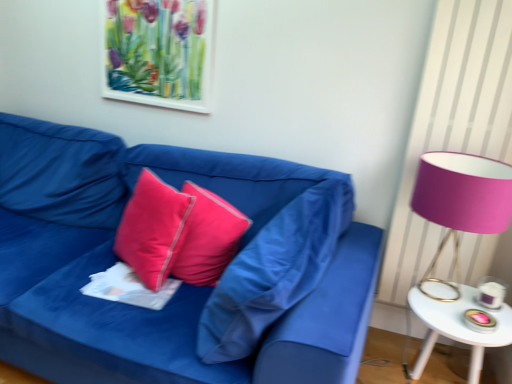
In order to click on blank space situated above white glossy side table at right (from a real-world perspective) in this screenshot , I will do `click(484, 314)`.